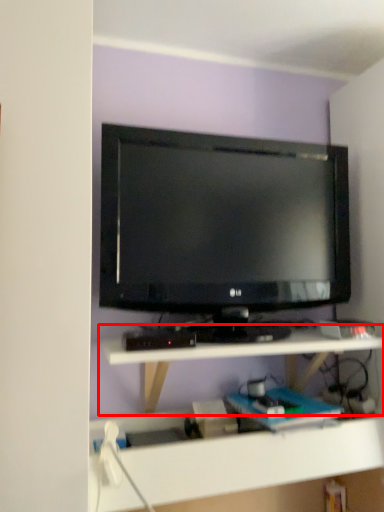
Question: Considering the relative positions of shelf (annotated by the red box) and television in the image provided, where is shelf (annotated by the red box) located with respect to the staircase?

Choices:
 (A) left
 (B) right

Answer: (A)